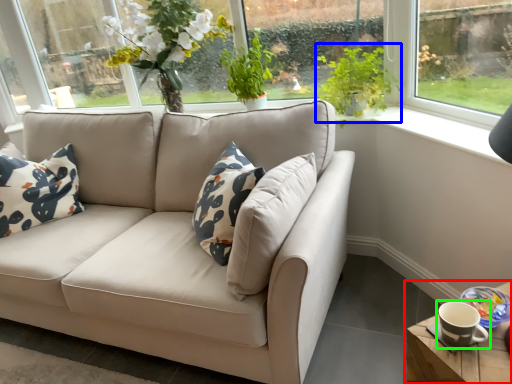
Question: Considering the real-world distances, which object is closest to table (highlighted by a red box)? plant (highlighted by a blue box) or coffee cup (highlighted by a green box).

Choices:
 (A) plant
 (B) coffee cup

Answer: (B)